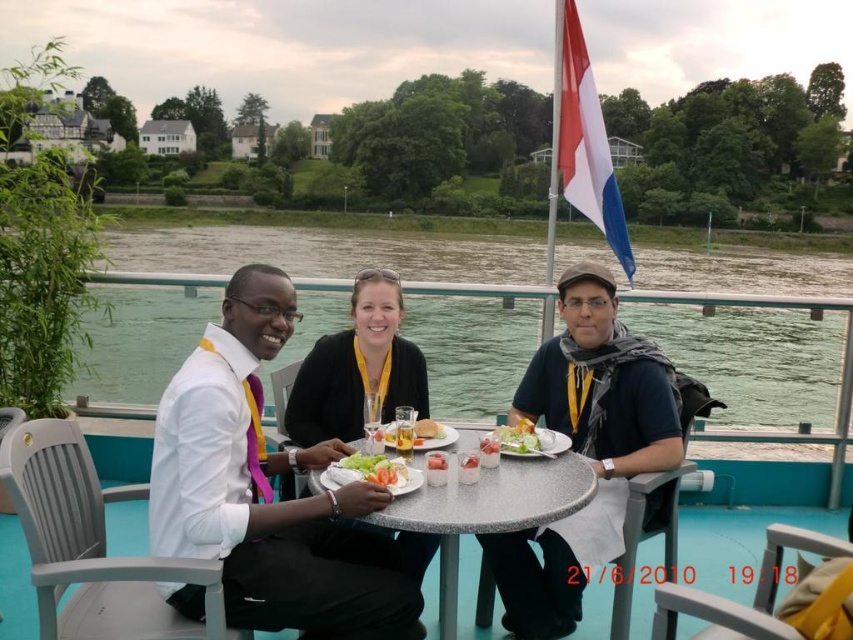
You are standing at the center of the table and want to pass a napkin to the person at point (439, 460). Which direction should you move to reach them without going past point (358, 458)?

Since point (358, 458) is behind point (439, 460), you should move forward towards point (439, 460) directly to avoid passing point (358, 458).

You are a waiter at this outdoor table. You need to place a new dessert on the white glossy plate at center without spilling the drink in the translucent plastic cup at center. Which object should you move first?

The white glossy plate at center is positioned under the translucent plastic cup at center, so you should move the cup first to avoid knocking it over while placing the dessert on the plate.